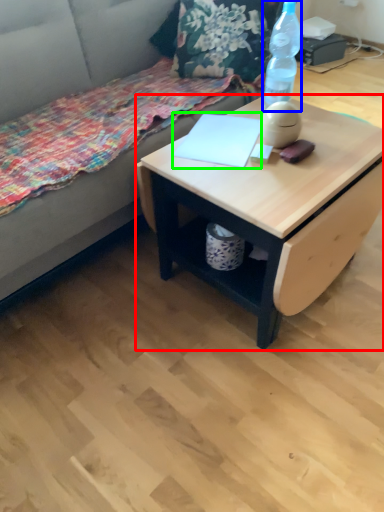
Question: Which is nearer to the desk (highlighted by a red box)? bottle (highlighted by a blue box) or notepad (highlighted by a green box).

Choices:
 (A) bottle
 (B) notepad

Answer: (B)